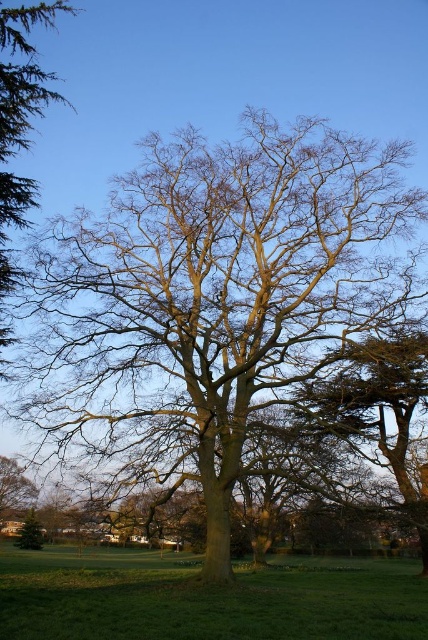
Question: Estimate the real-world distances between objects in this image. Which object is farther from the brown textured tree at center?

Choices:
 (A) smooth brown tree at upper left
 (B) brown rough bark tree at center

Answer: (A)

Question: Which object appears closest to the camera in this image?

Choices:
 (A) green grassy field at lower center
 (B) bare branches at center
 (C) brown textured tree at center
 (D) brown rough bark tree at center

Answer: (A)

Question: Is green grassy field at lower center to the right of smooth brown tree at upper left from the viewer's perspective?

Choices:
 (A) yes
 (B) no

Answer: (A)

Question: Which point is farther to the camera?

Choices:
 (A) (32, 532)
 (B) (386, 364)
 (C) (56, 12)
 (D) (110, 636)

Answer: (A)

Question: Can you confirm if green grassy field at lower center is positioned to the left of smooth brown tree at upper left?

Choices:
 (A) yes
 (B) no

Answer: (B)

Question: Is brown rough bark tree at center further to the viewer compared to brown textured tree at center?

Choices:
 (A) yes
 (B) no

Answer: (B)